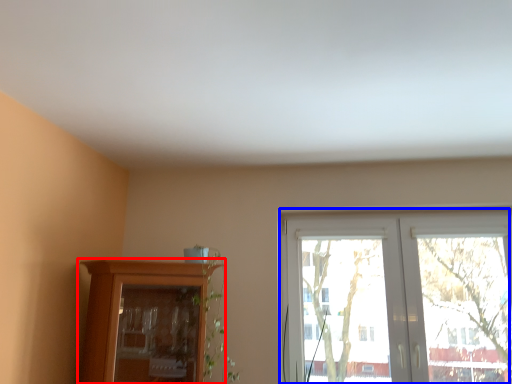
Question: Which object is further to the camera taking this photo, cupboard (highlighted by a red box) or window (highlighted by a blue box)?

Choices:
 (A) cupboard
 (B) window

Answer: (B)